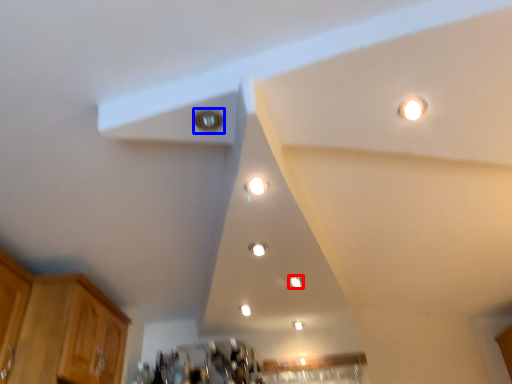
Question: Among these objects, which one is farthest to the camera, dot (highlighted by a red box) or light (highlighted by a blue box)?

Choices:
 (A) dot
 (B) light

Answer: (A)